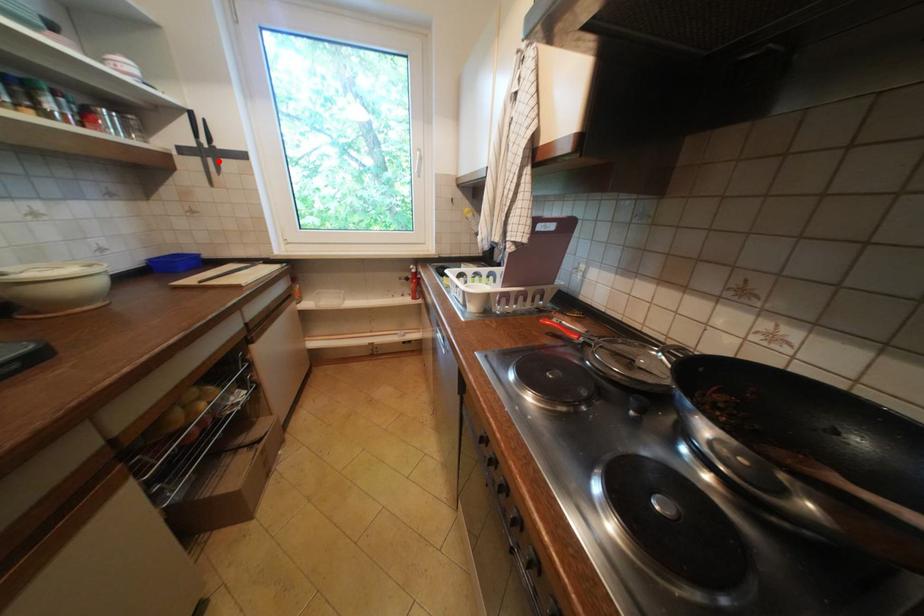
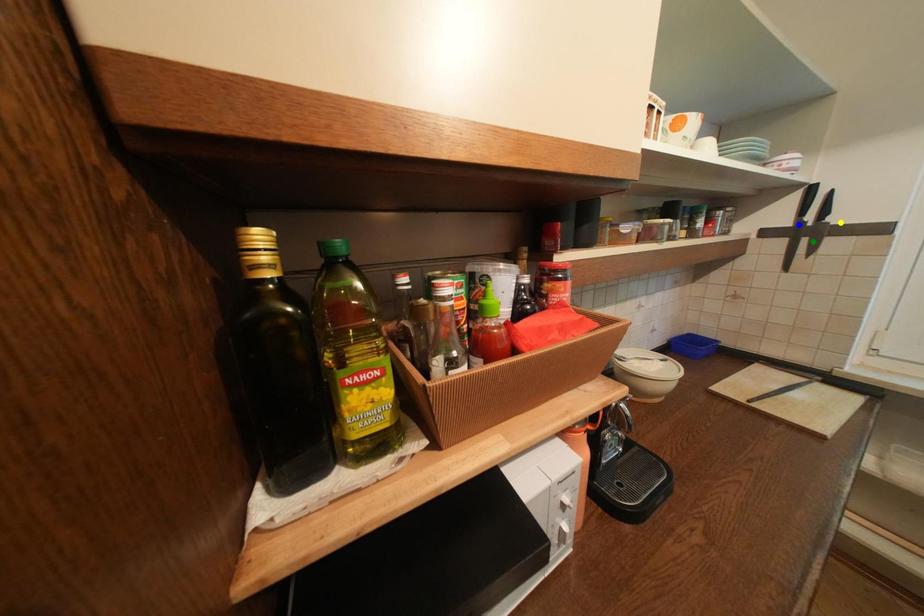
Question: I am providing you with two images of the same scene from different viewpoints. A red point is marked on the first image. You are given multiple points on the second image. In image 2, which mark is for the same physical point as the one in image 1?

Choices:
 (A) blue point
 (B) yellow point
 (C) green point

Answer: (C)